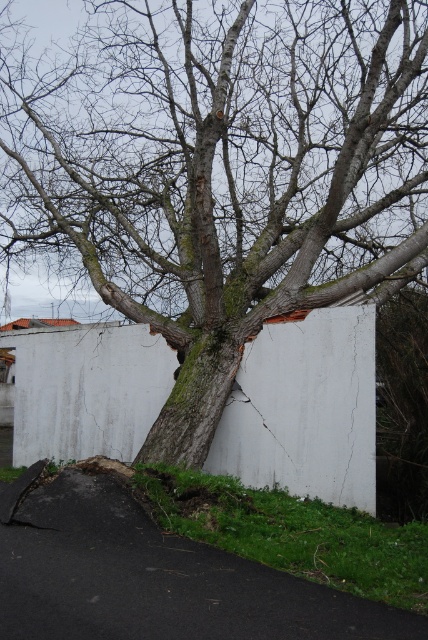
Question: Observing the image, what is the correct spatial positioning of green rough bark tree at center in reference to white concrete wall at center?

Choices:
 (A) right
 (B) left

Answer: (A)

Question: Which point is closer to the camera?

Choices:
 (A) green rough bark tree at center
 (B) white concrete wall at center

Answer: (A)

Question: Does green rough bark tree at center come behind white concrete wall at center?

Choices:
 (A) no
 (B) yes

Answer: (A)

Question: Which point is closer to the camera?

Choices:
 (A) (272, 116)
 (B) (80, 404)

Answer: (B)

Question: Among these points, which one is nearest to the camera?

Choices:
 (A) 92,408
 (B) 41,76

Answer: (A)

Question: Does green rough bark tree at center appear on the right side of white concrete wall at center?

Choices:
 (A) yes
 (B) no

Answer: (A)